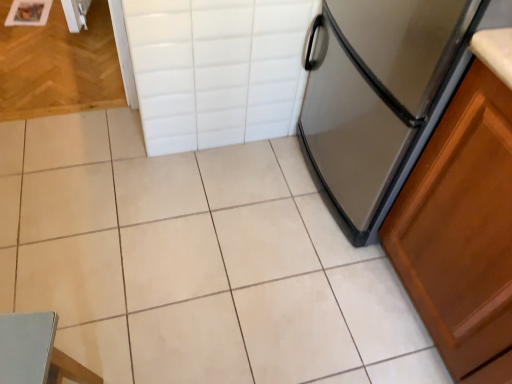
Question: Considering the relative sizes of satin silver refrigerator at right and white ceramic tile at center in the image provided, is satin silver refrigerator at right taller than white ceramic tile at center?

Choices:
 (A) yes
 (B) no

Answer: (A)

Question: Can you confirm if satin silver refrigerator at right is wider than white ceramic tile at center?

Choices:
 (A) yes
 (B) no

Answer: (B)

Question: Is satin silver refrigerator at right turned away from white ceramic tile at center?

Choices:
 (A) yes
 (B) no

Answer: (B)

Question: Can you confirm if satin silver refrigerator at right is smaller than white ceramic tile at center?

Choices:
 (A) yes
 (B) no

Answer: (B)

Question: Is satin silver refrigerator at right not close to white ceramic tile at center?

Choices:
 (A) yes
 (B) no

Answer: (B)

Question: Considering the positions of satin silver refrigerator at right and light blue fabric chair at lower left in the image, is satin silver refrigerator at right taller or shorter than light blue fabric chair at lower left?

Choices:
 (A) short
 (B) tall

Answer: (B)

Question: From a real-world perspective, is satin silver refrigerator at right physically located above or below light blue fabric chair at lower left?

Choices:
 (A) below
 (B) above

Answer: (B)

Question: In the image, is satin silver refrigerator at right positioned in front of or behind light blue fabric chair at lower left?

Choices:
 (A) behind
 (B) front

Answer: (A)

Question: Would you say satin silver refrigerator at right is inside or outside light blue fabric chair at lower left?

Choices:
 (A) inside
 (B) outside

Answer: (B)

Question: Is white tile drawer at upper center in front of or behind light blue fabric chair at lower left in the image?

Choices:
 (A) behind
 (B) front

Answer: (A)

Question: Does point (274, 21) appear closer or farther from the camera than point (44, 317)?

Choices:
 (A) farther
 (B) closer

Answer: (A)

Question: From the image's perspective, is white tile drawer at upper center positioned above or below light blue fabric chair at lower left?

Choices:
 (A) above
 (B) below

Answer: (A)

Question: From a real-world perspective, is white tile drawer at upper center positioned above or below light blue fabric chair at lower left?

Choices:
 (A) above
 (B) below

Answer: (A)

Question: Looking at their shapes, would you say satin silver refrigerator at right is wider or thinner than white tile drawer at upper center?

Choices:
 (A) wide
 (B) thin

Answer: (A)

Question: Is satin silver refrigerator at right spatially inside white tile drawer at upper center, or outside of it?

Choices:
 (A) outside
 (B) inside

Answer: (A)